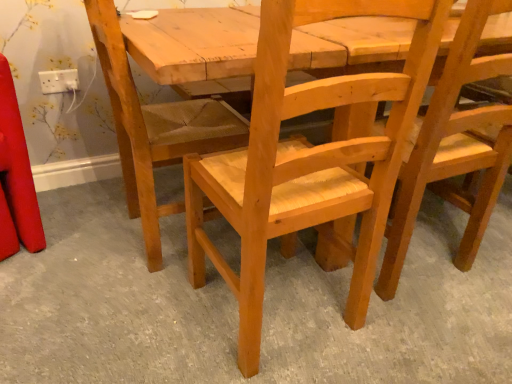
Where is `spots to the right of natural wood chair at center, which ranks as the third chair in left-to-right order`? This screenshot has height=384, width=512. spots to the right of natural wood chair at center, which ranks as the third chair in left-to-right order is located at coordinates (478, 248).